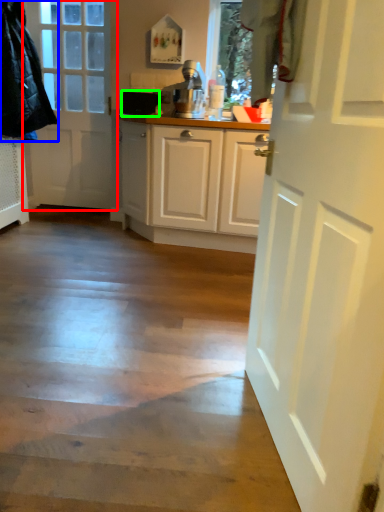
Question: Based on their relative distances, which object is farther from door (highlighted by a red box)? Choose from jacket (highlighted by a blue box) and appliance (highlighted by a green box).

Choices:
 (A) jacket
 (B) appliance

Answer: (B)